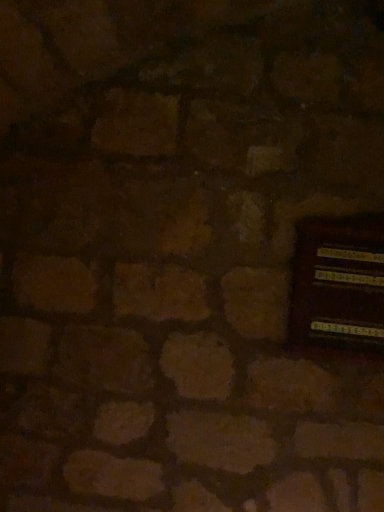
Question: Should I look upward or downward to see wooden panel at right?

Choices:
 (A) up
 (B) down

Answer: (B)